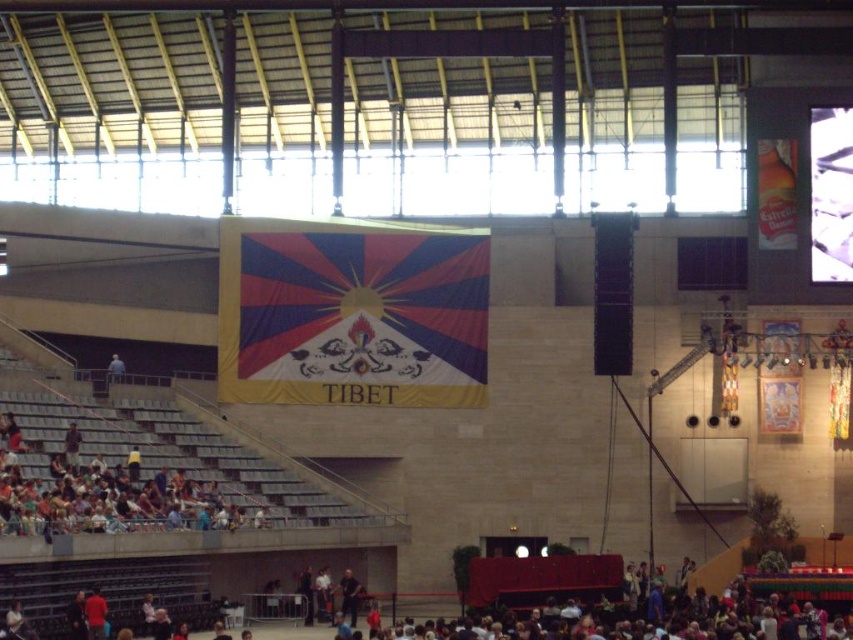
Question: Based on their relative distances, which object is nearer to the red fabric shirt at lower left?

Choices:
 (A) dark blue shirt at center
 (B) blue fabric at upper center

Answer: (A)

Question: Which point is closer to the camera?

Choices:
 (A) (117, 358)
 (B) (430, 262)
 (C) (358, 584)
 (D) (64, 445)

Answer: (D)

Question: Observing the image, what is the correct spatial positioning of polyester flag at center in reference to red fabric shirt at lower left?

Choices:
 (A) right
 (B) left

Answer: (A)

Question: Is polyester flag at center to the left of dark blue shirt at lower left from the viewer's perspective?

Choices:
 (A) yes
 (B) no

Answer: (B)

Question: Estimate the real-world distances between objects in this image. Which object is closer to the dark blue shirt at center?

Choices:
 (A) red fabric shirt at lower left
 (B) dark blue shirt at lower left
 (C) blue fabric at upper center
 (D) polyester flag at center

Answer: (B)

Question: Is polyester flag at center to the right of red fabric shirt at lower left from the viewer's perspective?

Choices:
 (A) no
 (B) yes

Answer: (B)